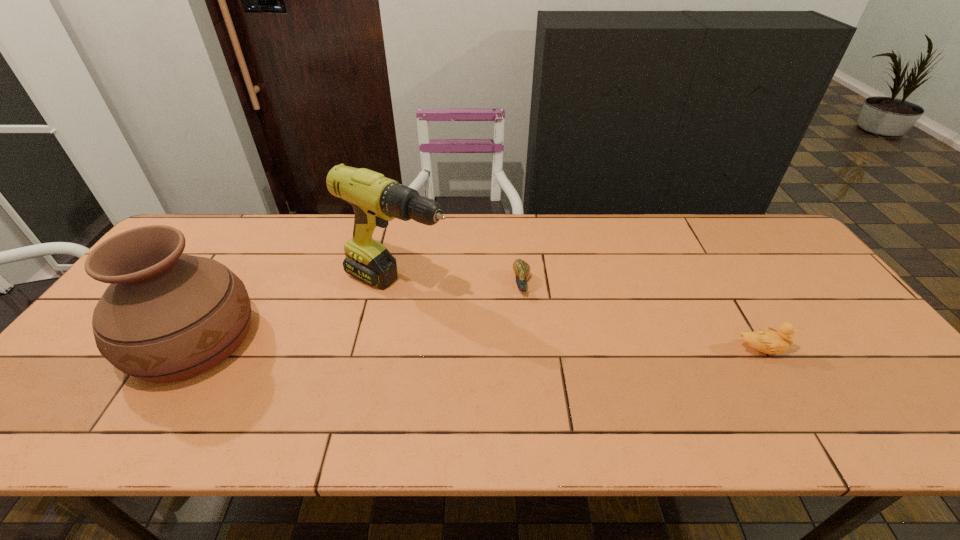
Find the location of a particular element. vacant region located on the front-facing side of the third object from left to right is located at coordinates (530, 366).

Find the location of a particular element. This screenshot has width=960, height=540. free space located on the front-facing side of the third object from left to right is located at coordinates (528, 343).

Identify the location of free space located on the front-facing side of the third object from left to right. This screenshot has height=540, width=960. (526, 332).

Locate an element on the screen. The image size is (960, 540). vacant space situated on the handle side of the tallest object is located at coordinates (x=467, y=312).

Identify the location of vacant space located 0.250m on the handle side of the tallest object. (523, 338).

The width and height of the screenshot is (960, 540). Find the location of `free space located on the handle side of the tallest object`. free space located on the handle side of the tallest object is located at coordinates (540, 346).

Where is `object at the near edge`? This screenshot has height=540, width=960. object at the near edge is located at coordinates (165, 317).

The height and width of the screenshot is (540, 960). I want to click on object positioned at the left edge, so click(165, 317).

The image size is (960, 540). In order to click on object positioned at the near left corner in this screenshot , I will do point(165,317).

At what (x,y) coordinates should I click in order to perform the action: click on vacant area at the far edge. Please return your answer as a coordinate pair (x, y). The width and height of the screenshot is (960, 540). Looking at the image, I should click on (701, 253).